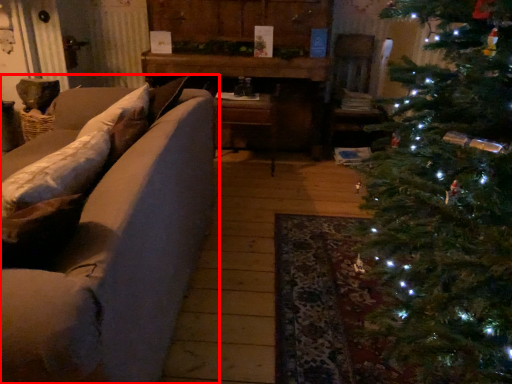
Question: Where is studio couch (annotated by the red box) located in relation to table in the image?

Choices:
 (A) right
 (B) left

Answer: (B)